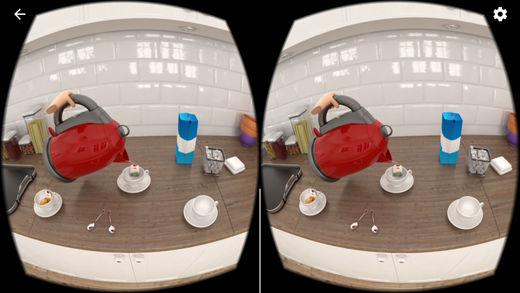
Where is `empty cup`? This screenshot has width=520, height=293. empty cup is located at coordinates (209, 203), (466, 203).